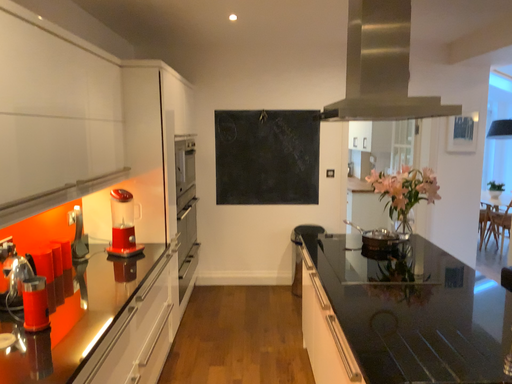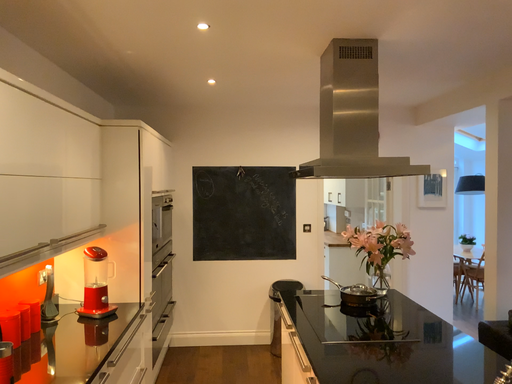
Question: Which way did the camera rotate in the video?

Choices:
 (A) rotated upward
 (B) rotated downward

Answer: (A)